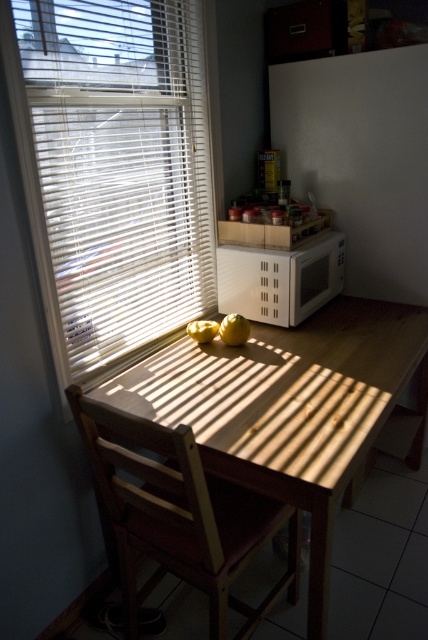
Which is behind, point (142, 273) or point (178, 458)?

Point (142, 273)

Based on the photo, which is more to the right, white plastic blinds at upper left or wooden chair at lower left?

Positioned to the right is wooden chair at lower left.

Between point (80, 317) and point (130, 612), which one is positioned behind?

Point (80, 317)

Locate an element on the screen. This screenshot has width=428, height=640. white plastic blinds at upper left is located at coordinates (112, 172).

Which is above, white plastic blinds at upper left or yellow matte apple at center?

white plastic blinds at upper left is above.

Identify the location of white plastic blinds at upper left. (112, 172).

Image resolution: width=428 pixels, height=640 pixels. What do you see at coordinates (112, 172) in the screenshot? I see `white plastic blinds at upper left` at bounding box center [112, 172].

Is point (65, 83) farther from camera compared to point (234, 342)?

No, (65, 83) is in front of (234, 342).

At what (x,y) coordinates should I click in order to perform the action: click on white plastic blinds at upper left. Please return your answer as a coordinate pair (x, y). The height and width of the screenshot is (640, 428). Looking at the image, I should click on [112, 172].